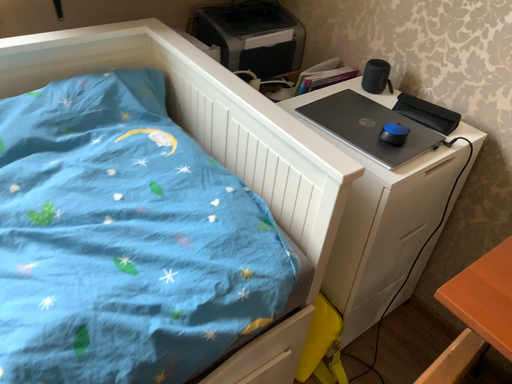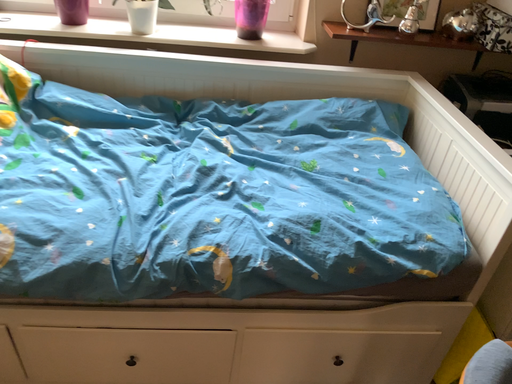
Question: Which way did the camera rotate in the video?

Choices:
 (A) rotated downward
 (B) rotated upward

Answer: (B)